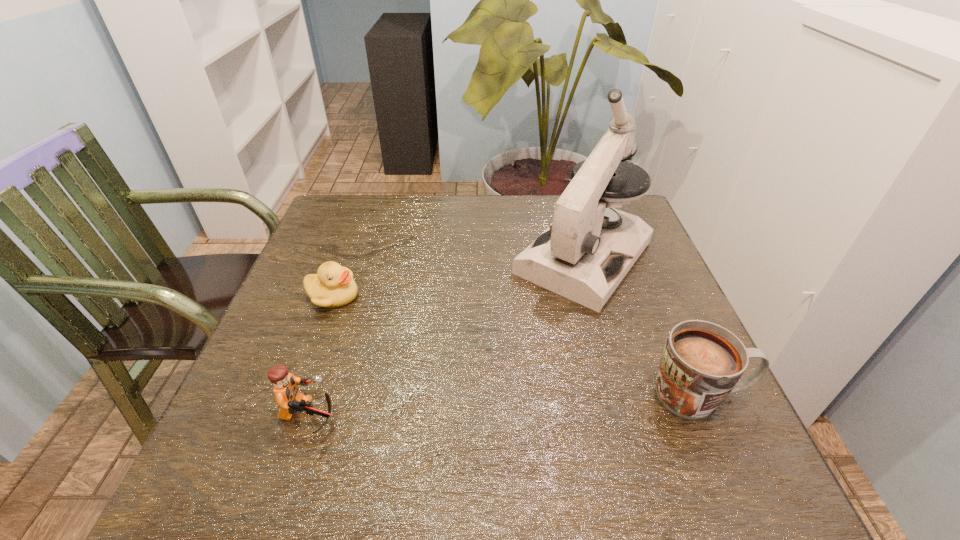
Locate an element on the screen. This screenshot has width=960, height=540. Lego is located at coordinates (290, 400).

You are a GUI agent. You are given a task and a screenshot of the screen. Output one action in this format:
    pyautogui.click(x=<x>, y=<y>)
    Task: Click on the mug
    The height and width of the screenshot is (540, 960).
    Given the screenshot: What is the action you would take?
    pyautogui.click(x=701, y=364)

Find the location of a particular element. the tallest object is located at coordinates (585, 253).

Find the location of a particular element. duckling is located at coordinates (333, 286).

Find the location of a particular element. The height and width of the screenshot is (540, 960). vacant space situated 0.220m holding a crossbow in the hands of the Lego is located at coordinates (461, 416).

The image size is (960, 540). Identify the location of free space located 0.110m at the eyepiece of the microscope. (523, 330).

Identify the location of vacant space located 0.140m at the eyepiece of the microscope. (516, 339).

Image resolution: width=960 pixels, height=540 pixels. Identify the location of vacant area situated 0.240m at the eyepiece of the microscope. tap(489, 370).

The image size is (960, 540). Identify the location of free space located on the front-facing side of the duckling. point(449,406).

You are a GUI agent. You are given a task and a screenshot of the screen. Output one action in this format:
    pyautogui.click(x=<x>, y=<y>)
    Task: Click on the free space located on the front-facing side of the duckling
    The image size is (960, 540).
    Given the screenshot: What is the action you would take?
    pyautogui.click(x=361, y=323)